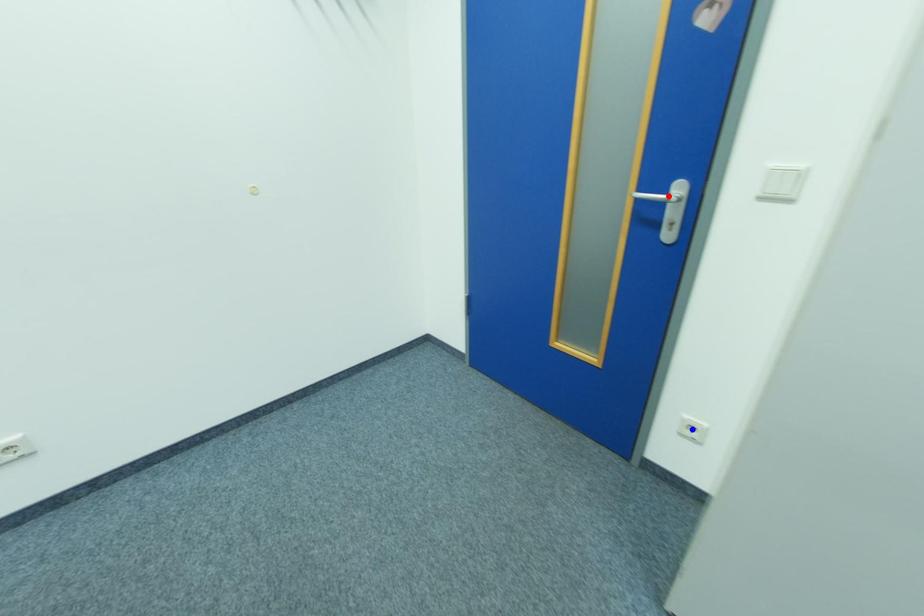
Question: Which of the two points in the image is closer to the camera?

Choices:
 (A) Blue point is closer.
 (B) Red point is closer.

Answer: (B)